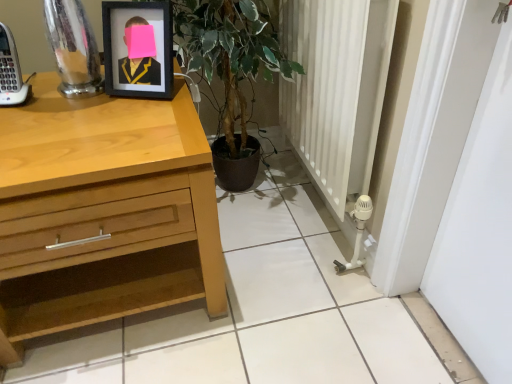
Question: Would you say black matte picture frame at upper left is to the left or to the right of light wood chest of drawers at left in the picture?

Choices:
 (A) right
 (B) left

Answer: (A)

Question: From the image's perspective, is black matte picture frame at upper left above or below light wood chest of drawers at left?

Choices:
 (A) below
 (B) above

Answer: (B)

Question: In the image, is black matte picture frame at upper left positioned in front of or behind light wood chest of drawers at left?

Choices:
 (A) front
 (B) behind

Answer: (B)

Question: Considering the positions of light wood chest of drawers at left and black matte picture frame at upper left in the image, is light wood chest of drawers at left wider or thinner than black matte picture frame at upper left?

Choices:
 (A) wide
 (B) thin

Answer: (A)

Question: From a real-world perspective, is light wood chest of drawers at left physically located above or below black matte picture frame at upper left?

Choices:
 (A) above
 (B) below

Answer: (B)

Question: Is light wood chest of drawers at left spatially inside black matte picture frame at upper left, or outside of it?

Choices:
 (A) outside
 (B) inside

Answer: (A)

Question: In terms of height, does light wood chest of drawers at left look taller or shorter compared to black matte picture frame at upper left?

Choices:
 (A) short
 (B) tall

Answer: (B)